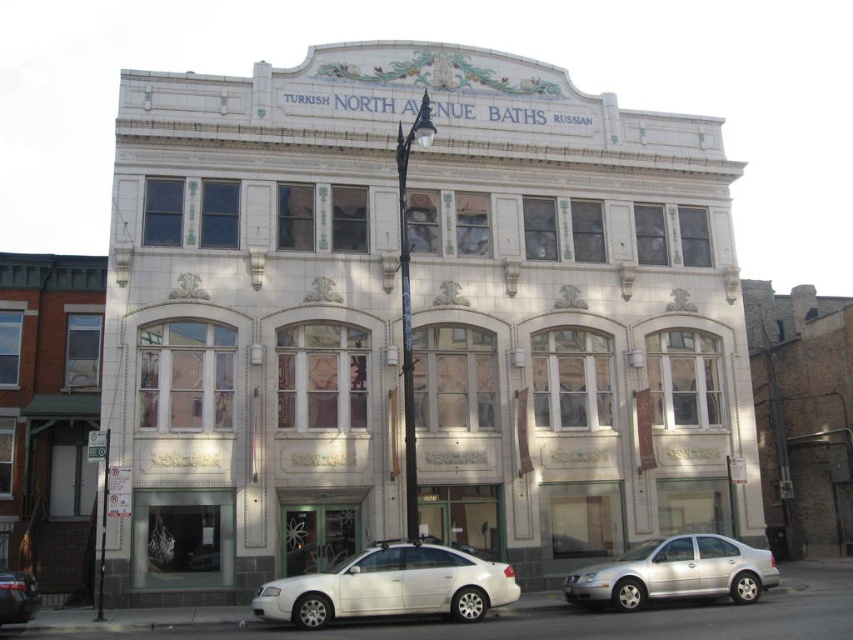
Question: Is white matte sedan at lower center positioned in front of white glossy sedan at lower left?

Choices:
 (A) no
 (B) yes

Answer: (A)

Question: Which object is closer to the camera taking this photo?

Choices:
 (A) silver metallic sedan at lower right
 (B) white matte sedan at lower center

Answer: (B)

Question: Does white matte sedan at lower center have a larger size compared to silver metallic sedan at lower right?

Choices:
 (A) yes
 (B) no

Answer: (B)

Question: Which point is closer to the camera?

Choices:
 (A) coord(16,586)
 (B) coord(631,584)

Answer: (A)

Question: Which point is farther from the camera taking this photo?

Choices:
 (A) (386, 593)
 (B) (3, 576)

Answer: (A)

Question: Does white matte sedan at lower center lie behind silver metallic sedan at lower right?

Choices:
 (A) yes
 (B) no

Answer: (B)